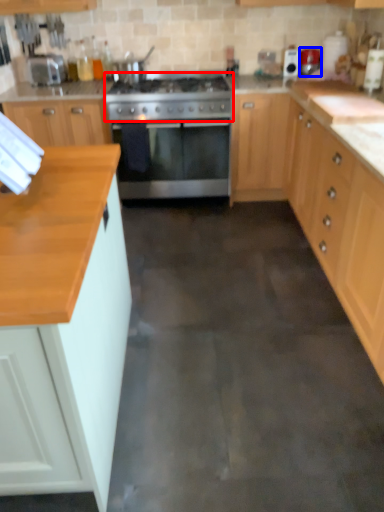
Question: Which point is closer to the camera, gas stove (highlighted by a red box) or appliance (highlighted by a blue box)?

Choices:
 (A) gas stove
 (B) appliance

Answer: (A)